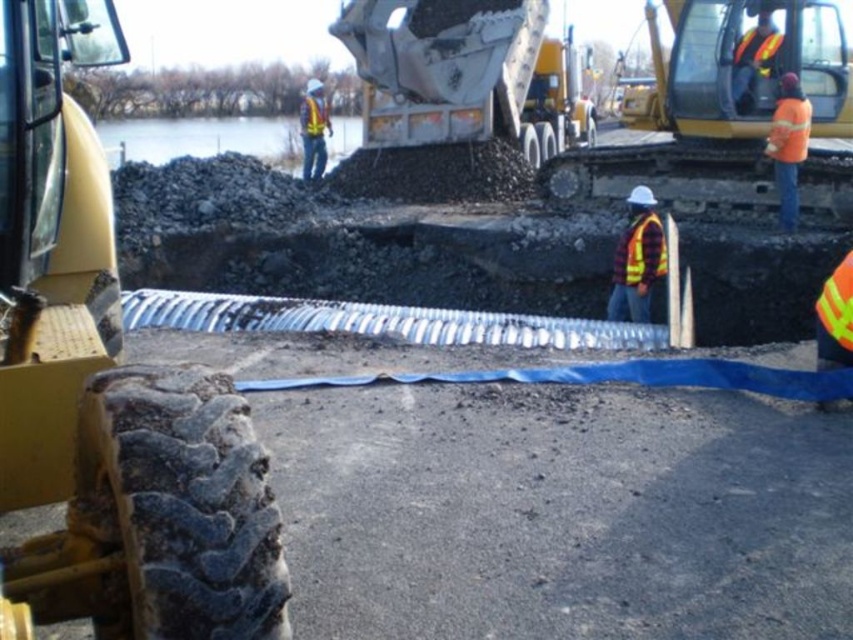
Is high visibility fabric safety vest at center closer to the viewer compared to orange reflective safety vest at right?

Yes, high visibility fabric safety vest at center is closer to the viewer.

Who is positioned more to the right, high visibility fabric safety vest at center or orange reflective safety vest at right?

orange reflective safety vest at right is more to the right.

The width and height of the screenshot is (853, 640). Identify the location of high visibility fabric safety vest at center. (834, 316).

Between high visibility fabric safety vest at center and yellow reflective safety vest at center, which one has less height?

With less height is high visibility fabric safety vest at center.

Is high visibility fabric safety vest at center smaller than yellow reflective safety vest at center?

Yes, high visibility fabric safety vest at center is smaller than yellow reflective safety vest at center.

Image resolution: width=853 pixels, height=640 pixels. Describe the element at coordinates (834, 316) in the screenshot. I see `high visibility fabric safety vest at center` at that location.

Where is `high visibility fabric safety vest at center`? Image resolution: width=853 pixels, height=640 pixels. high visibility fabric safety vest at center is located at coordinates (834, 316).

Is yellow rubber track at upper right positioned in front of orange reflective safety vest at right?

No, it is behind orange reflective safety vest at right.

Between yellow rubber track at upper right and orange reflective safety vest at right, which one is positioned higher?

yellow rubber track at upper right is above.

Which is in front, point (695, 138) or point (790, 157)?

Positioned in front is point (790, 157).

Identify the location of yellow rubber track at upper right. (712, 109).